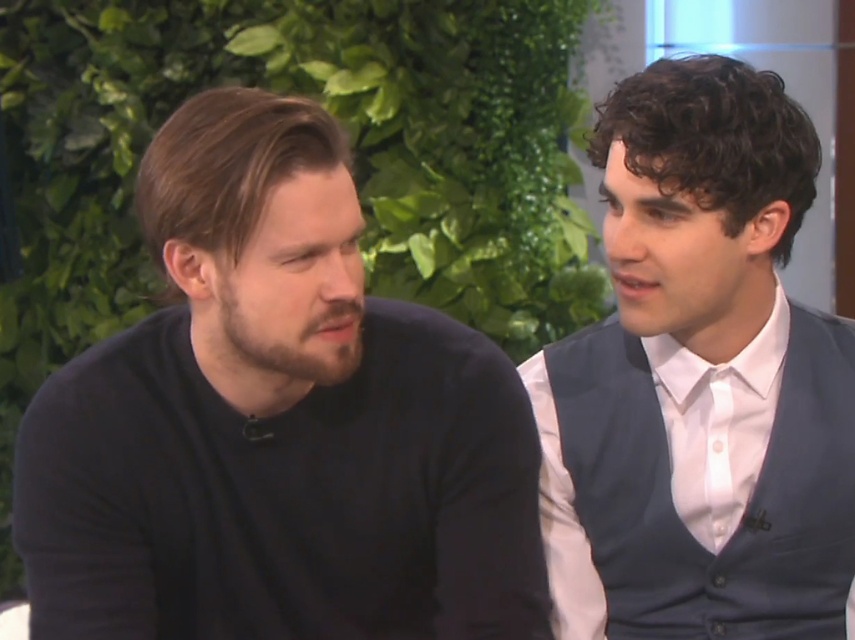
You are a photographer adjusting your camera settings to focus on both the black matte sweater at left and the white satin shirt at right in the image. Which object should you focus on first to ensure both are in focus?

You should focus on the black matte sweater at left first since it is closer to the viewer, allowing the white satin shirt at right to fall within the depth of field.